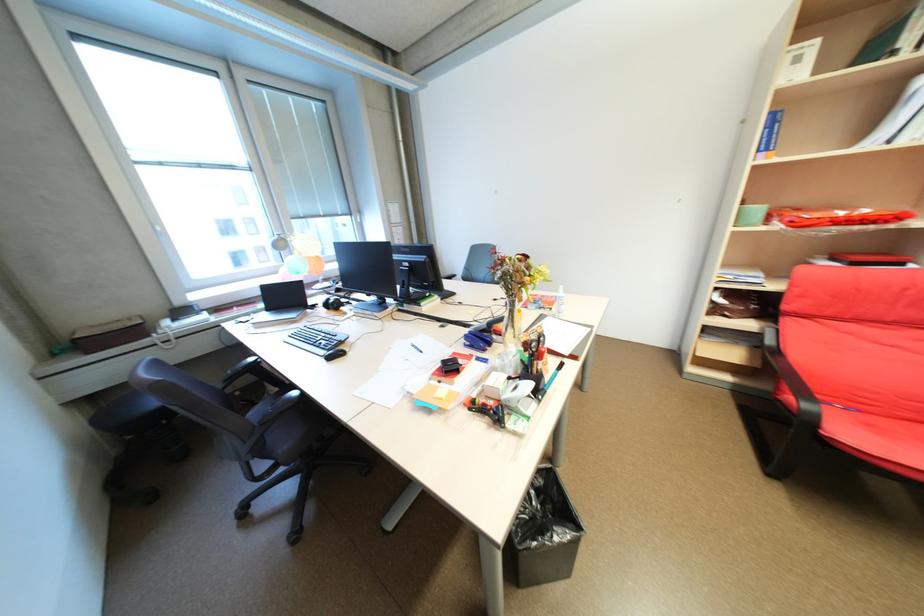
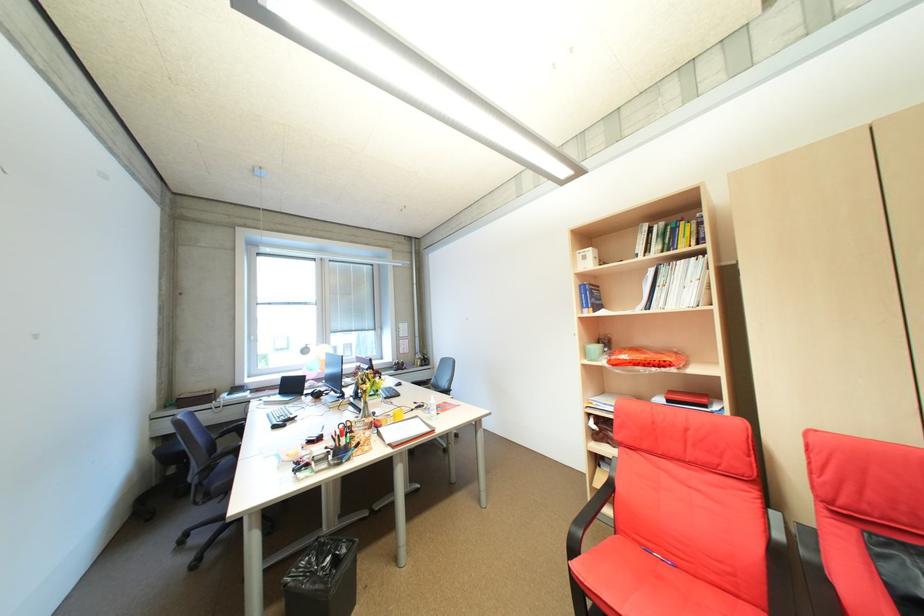
Locate, in the second image, the point that corresponds to the point at 738,277 in the first image.

(603, 403)